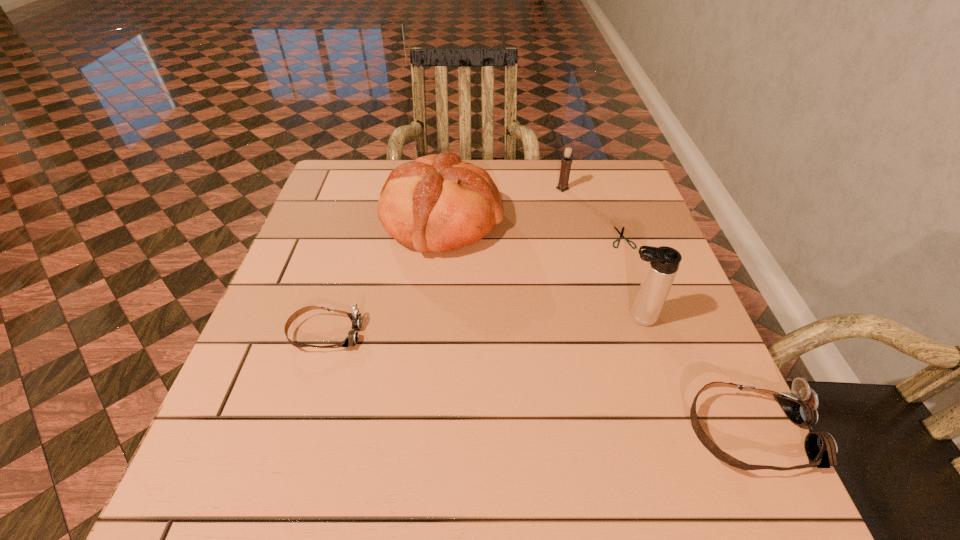
I want to click on goggles present at the right edge, so click(x=800, y=406).

At what (x,y) coordinates should I click in order to perform the action: click on shears present at the right edge. Please return your answer as a coordinate pair (x, y). Image resolution: width=960 pixels, height=540 pixels. Looking at the image, I should click on (621, 234).

Find the location of `thermos bottle that is at the right edge`. thermos bottle that is at the right edge is located at coordinates (663, 262).

This screenshot has height=540, width=960. In order to click on object situated at the near right corner in this screenshot , I will do 800,406.

Identify the location of vacant space at the far edge of the desktop. This screenshot has height=540, width=960. (385, 183).

Identify the location of vacant point at the near edge. Image resolution: width=960 pixels, height=540 pixels. (516, 414).

The width and height of the screenshot is (960, 540). I want to click on free space at the left edge, so click(354, 219).

The image size is (960, 540). I want to click on free space at the right edge, so click(640, 281).

The width and height of the screenshot is (960, 540). I want to click on vacant region at the far left corner of the desktop, so click(x=344, y=170).

In the image, there is a desktop. Identify the location of vacant region at the near left corner. Image resolution: width=960 pixels, height=540 pixels. (250, 420).